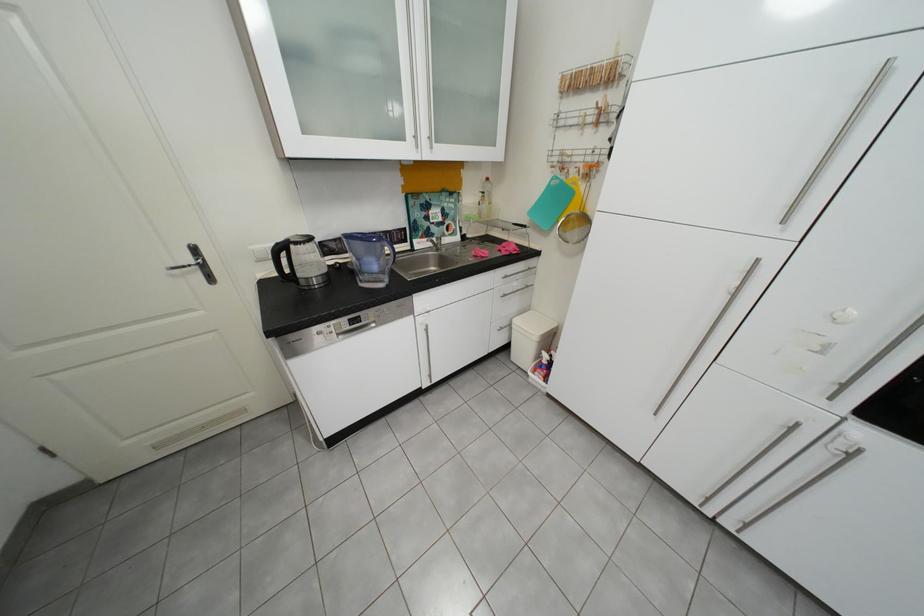
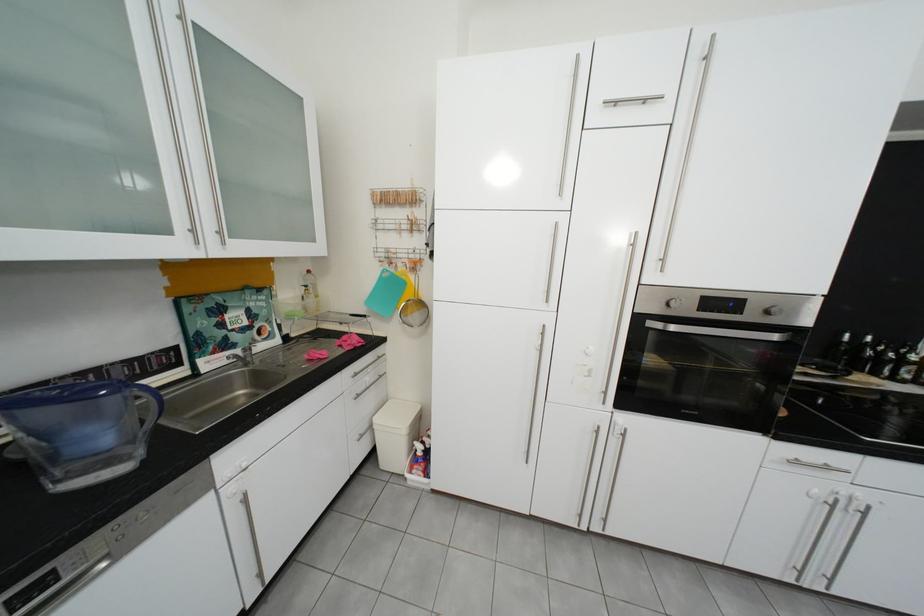
In the second image, find the point that corresponds to (444,243) in the first image.

(248, 358)